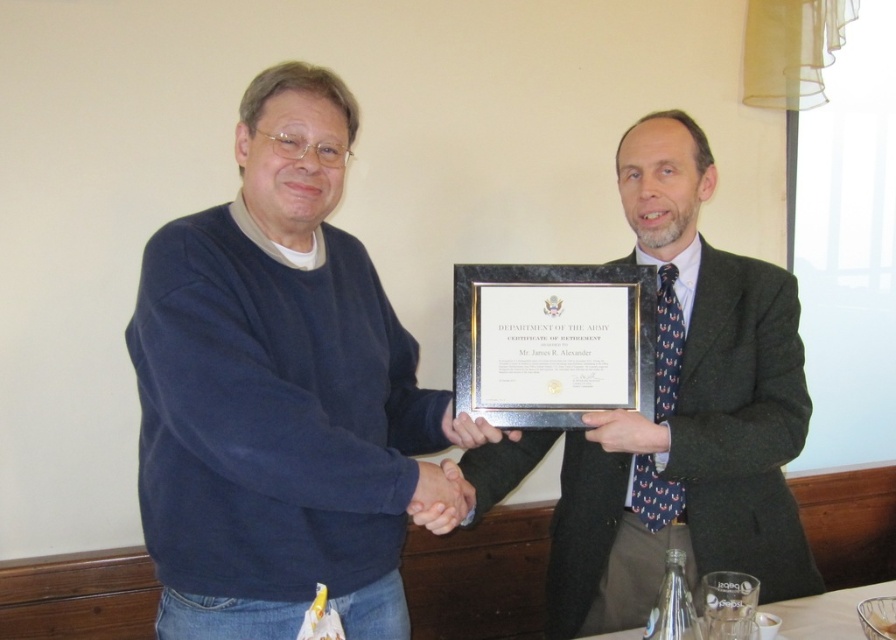
You are a photographer taking a picture of the two men shaking hands. You need to focus on the point closer to the viewer between point (x=412, y=436) and point (x=556, y=579). Which point should you focus on?

You should focus on point (x=412, y=436) because it is closer to the viewer than point (x=556, y=579).

You are an event photographer at a retirement ceremony. You need to capture a photo where both the matte blue sweater at center and the dark gray suit at center are visible. Based on their heights, which one might you need to adjust your camera angle to include fully in the frame?

The matte blue sweater at center is not as tall as the dark gray suit at center, so you might need to adjust the camera angle to ensure the taller dark gray suit at center is fully captured in the frame.